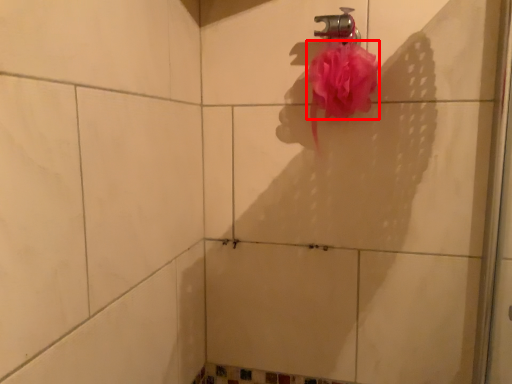
Question: In this image, where is blood (annotated by the red box) located relative to plumbing fixture?

Choices:
 (A) left
 (B) right

Answer: (B)